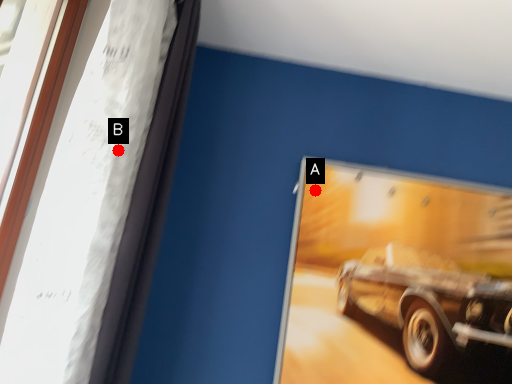
Question: Two points are circled on the image, labeled by A and B beside each circle. Which of the following is the closest to the observer?

Choices:
 (A) A is closer
 (B) B is closer

Answer: (B)